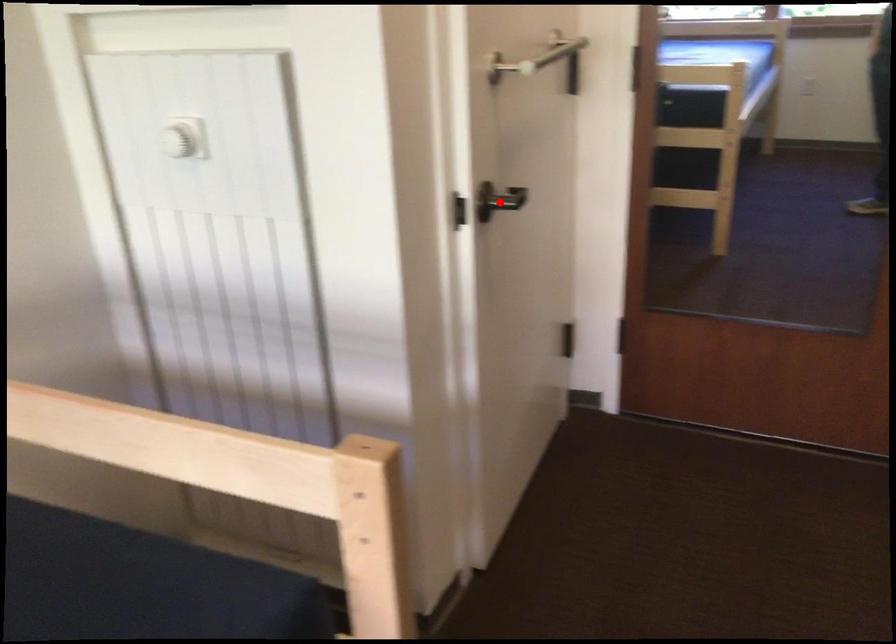
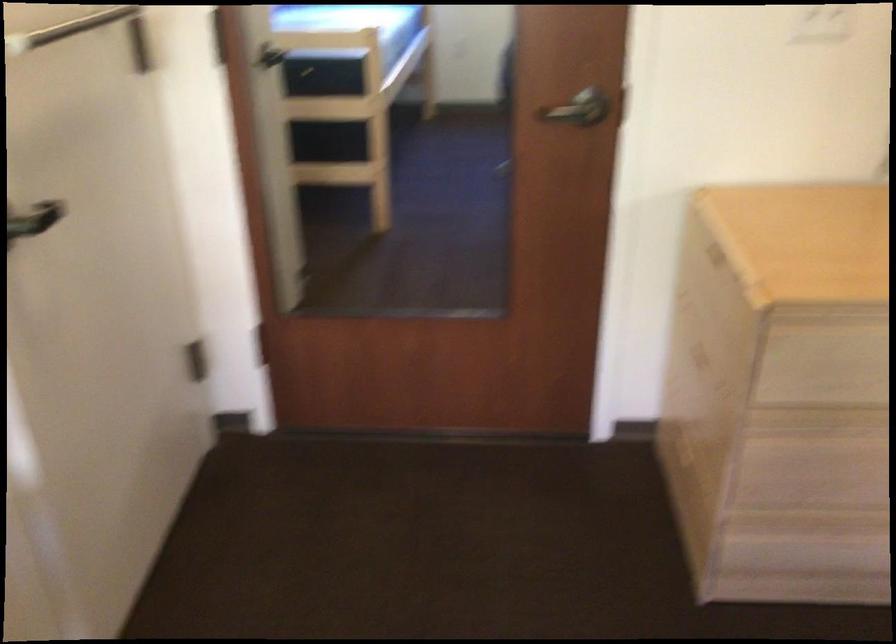
Question: I am providing you with two images of the same scene from different viewpoints. In image1, a red point is highlighted. Considering the same 3D point in image2, which of the following is correct?

Choices:
 (A) It is closer
 (B) It is farther

Answer: (A)